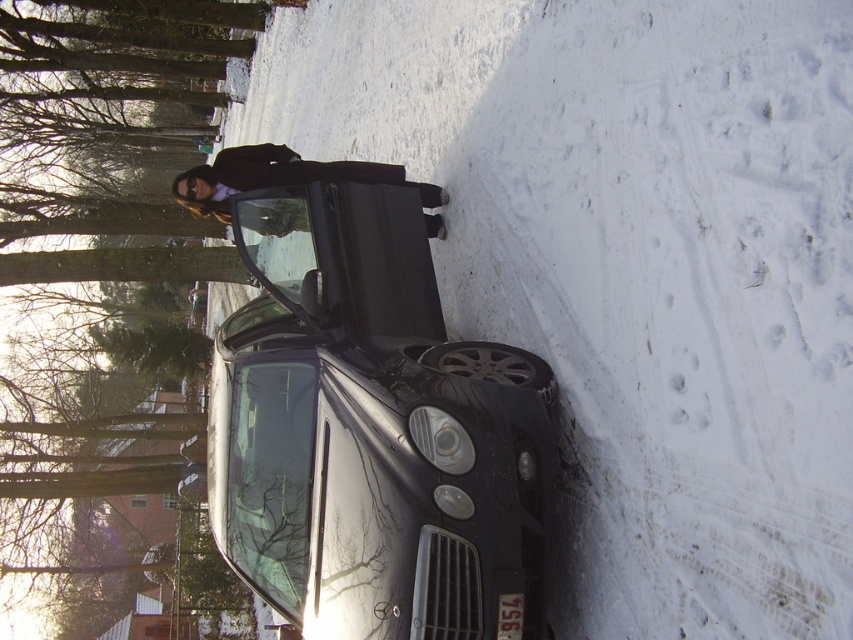
Between glossy black car at center and black fabric coat at center, which one has less height?

Standing shorter between the two is black fabric coat at center.

Which is in front, point (527, 540) or point (223, 202)?

Point (527, 540)

This screenshot has height=640, width=853. I want to click on glossy black car at center, so click(372, 429).

From the picture: Is white powdery snow at center thinner than black plastic license plate at lower center?

No.

At what (x,y) coordinates should I click in order to perform the action: click on white powdery snow at center. Please return your answer as a coordinate pair (x, y). The image size is (853, 640). Looking at the image, I should click on (631, 268).

Between point (531, 10) and point (498, 608), which one is positioned behind?

The point (531, 10) is more distant.

At what (x,y) coordinates should I click in order to perform the action: click on white powdery snow at center. Please return your answer as a coordinate pair (x, y). Image resolution: width=853 pixels, height=640 pixels. Looking at the image, I should click on (631, 268).

Is black fabric coat at center closer to the viewer compared to black plastic license plate at lower center?

That is False.

Between point (225, 182) and point (508, 621), which one is positioned behind?

Positioned behind is point (225, 182).

Which is in front, point (200, 172) or point (497, 609)?

Point (497, 609) is in front.

Locate an element on the screen. black fabric coat at center is located at coordinates (279, 177).